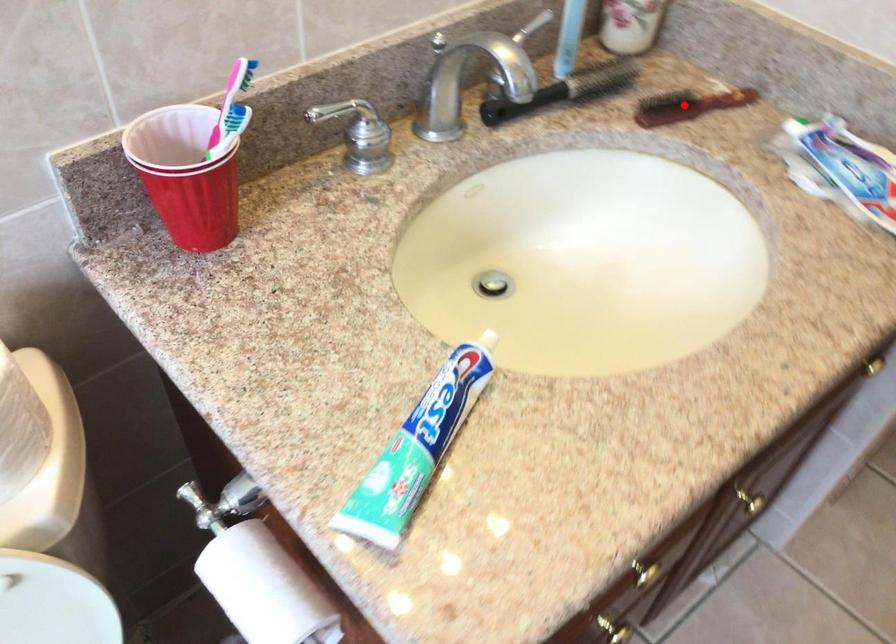
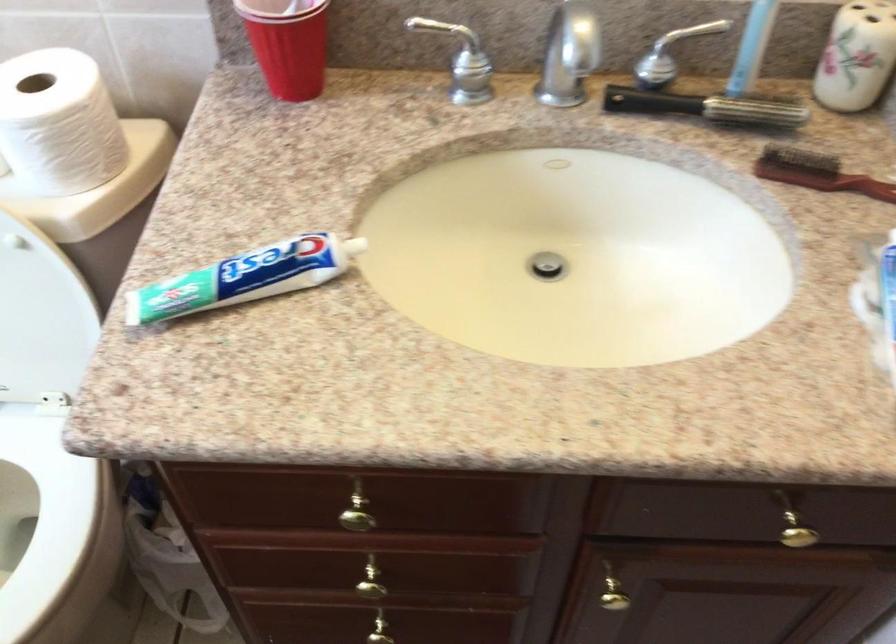
In the second image, find the point that corresponds to the highlighted location in the first image.

(816, 173)